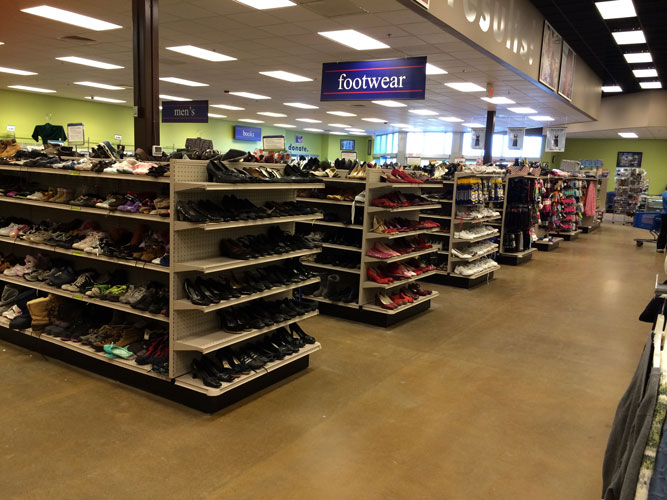
Locate an element on the screen. This screenshot has height=500, width=667. ceiling is located at coordinates (556, 112).